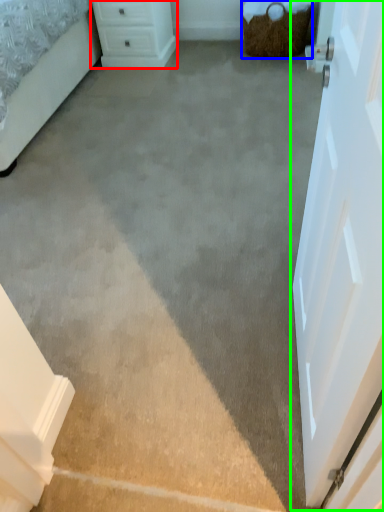
Question: Which is nearer to the chest of drawers (highlighted by a red box)? basket (highlighted by a blue box) or door (highlighted by a green box).

Choices:
 (A) basket
 (B) door

Answer: (A)